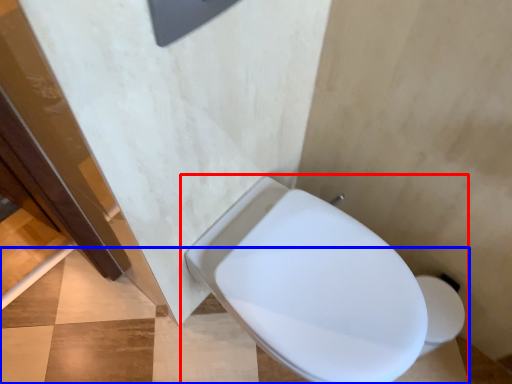
Question: Among these objects, which one is farthest to the camera, toilet (highlighted by a red box) or concrete (highlighted by a blue box)?

Choices:
 (A) toilet
 (B) concrete

Answer: (B)